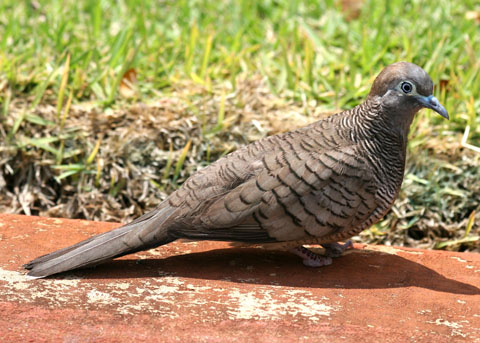
This screenshot has height=343, width=480. Identify the location of flat surface. (256, 313).